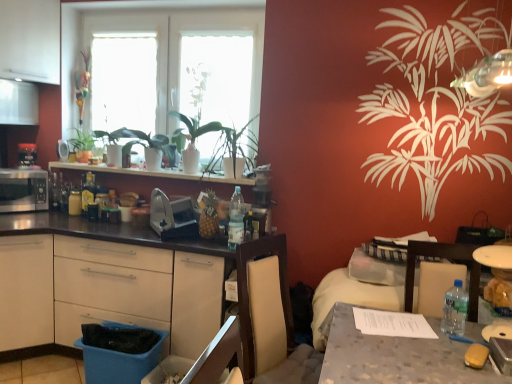
Question: From the image's perspective, is matte silver microwave at left, arranged as the 4th appliance when viewed from the right, positioned above or below blue plastic drawer at lower left?

Choices:
 (A) above
 (B) below

Answer: (A)

Question: Considering the positions of matte silver microwave at left, the first appliance viewed from the left, and blue plastic drawer at lower left in the image, is matte silver microwave at left, the first appliance viewed from the left, wider or thinner than blue plastic drawer at lower left?

Choices:
 (A) thin
 (B) wide

Answer: (B)

Question: Which of these objects is positioned closest to the metallic silver toaster at upper left, the third appliance viewed from the left?

Choices:
 (A) translucent plastic bottle at center, which is the 2th bottle in left-to-right order
 (B) white glossy shelf at upper center
 (C) satin silver toaster at center, acting as the fourth appliance starting from the left
 (D) matte silver microwave at left, the first appliance viewed from the left
 (E) green leafy plant at left

Answer: (E)

Question: Which object is positioned farthest from the white glossy shelf at upper center?

Choices:
 (A) transparent glass window screen at upper center, acting as the first window screen starting from the left
 (B) white matte window screen at upper center, which ranks as the 1th window screen in right-to-left order
 (C) metallic silver toaster at left, placed as the third appliance when sorted from right to left
 (D) black matte countertop at left
 (E) white glass window at upper center

Answer: (D)